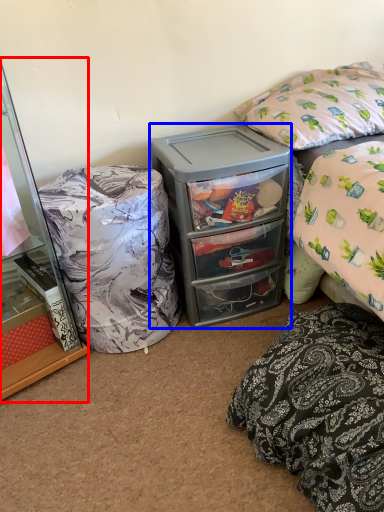
Question: Which object is further to the camera taking this photo, cabinetry (highlighted by a red box) or cooler (highlighted by a blue box)?

Choices:
 (A) cabinetry
 (B) cooler

Answer: (B)